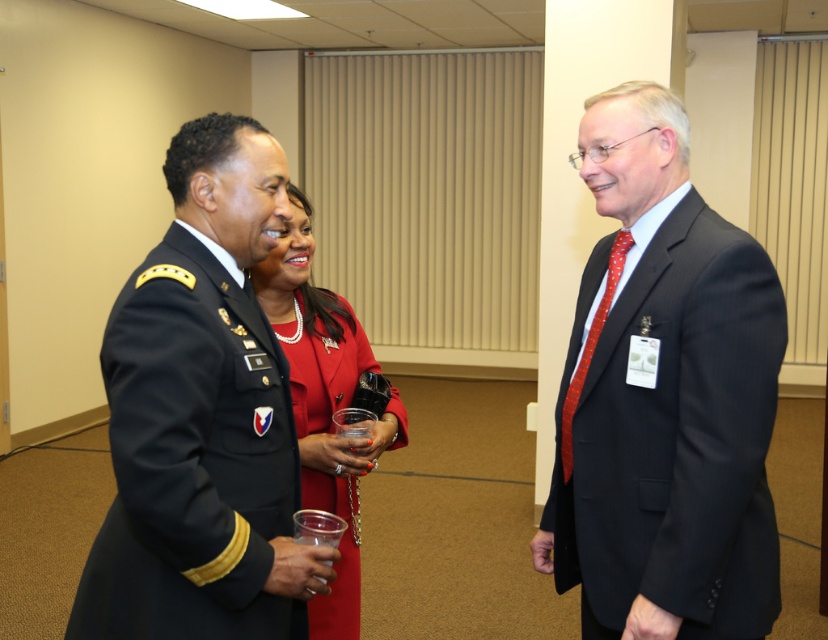
You are organizing a charity event and need to place a large donation box next to the matte black suit at right and the transparent plastic cup at center. Since the donation box is 1.2 meters wide, will it fit between them?

The matte black suit at right is bigger than the transparent plastic cup at center, but the description does not provide specific spatial measurements between them. Therefore, it is unclear if the 1.2 meter wide donation box will fit between them.

You are a photographer at a formal event and need to capture a group photo of the shiny black uniform at center and the shiny red coat at center. The camera you are using has a minimum focus distance of 14 inches. Can you take a clear photo of both subjects without moving them?

The shiny black uniform at center and shiny red coat at center are 14.09 inches apart from each other, which is slightly more than the camera minimum focus distance of 14 inches. Therefore, you can take a clear photo of both subjects without moving them.

You are standing in the room and want to hand a document to both individuals wearing the shiny black uniform at center and the shiny red coat at center. Based on their positions, which one is higher up and should I approach first?

The shiny black uniform at center is located above the shiny red coat at center, so you should approach the shiny black uniform at center first since it is higher up.